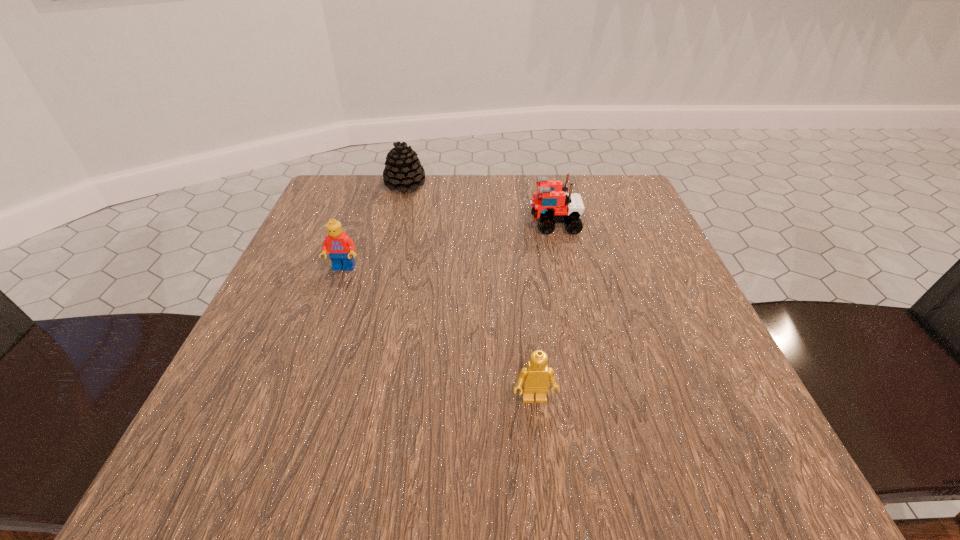
Where is `pinecone`? This screenshot has width=960, height=540. pinecone is located at coordinates (403, 170).

Find the location of a particular element. The image size is (960, 540). the second farthest object is located at coordinates (551, 204).

Find the location of `the leftmost Lego`. the leftmost Lego is located at coordinates (340, 247).

Identify the location of the second nearest Lego. (340, 247).

Where is `the nearest object`? This screenshot has height=540, width=960. the nearest object is located at coordinates (535, 376).

This screenshot has height=540, width=960. I want to click on vacant region located at the narrow end of the pinecone, so click(x=383, y=273).

Identify the location of free location located on the front-facing side of the farthest Lego. This screenshot has height=540, width=960. (367, 224).

Locate an element on the screen. The height and width of the screenshot is (540, 960). free space located 0.220m on the front-facing side of the farthest Lego is located at coordinates (427, 224).

I want to click on vacant space positioned on the front-facing side of the farthest Lego, so click(x=492, y=224).

This screenshot has width=960, height=540. What are the coordinates of `vacant space located on the face of the second nearest object` in the screenshot? It's located at (322, 330).